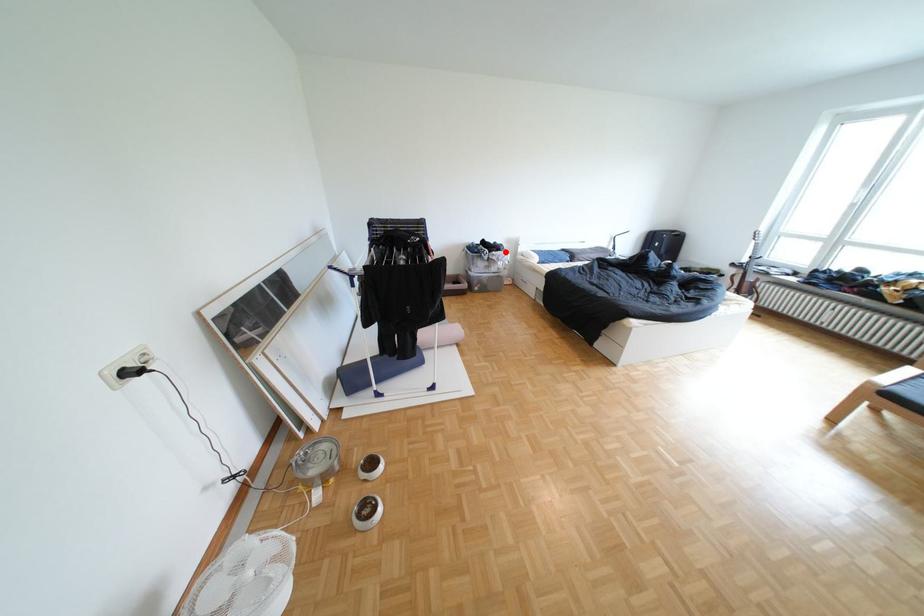
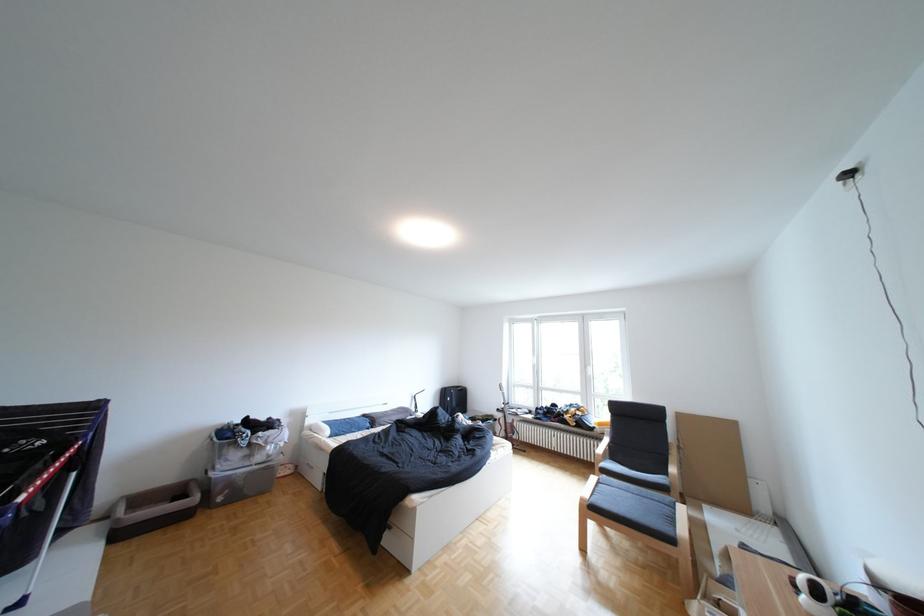
Locate, in the second image, the point that corresponds to the highlighted location in the first image.

(270, 434)